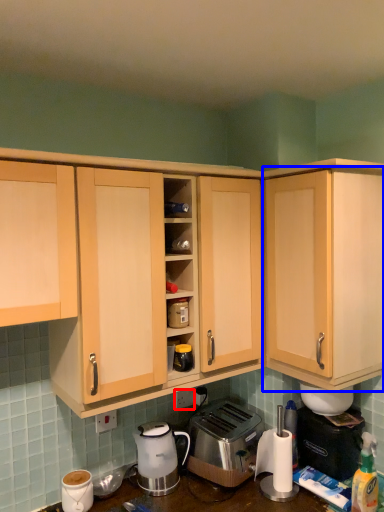
Question: Which of the following is the closest to the observer, electric outlet (highlighted by a red box) or cabinetry (highlighted by a blue box)?

Choices:
 (A) electric outlet
 (B) cabinetry

Answer: (B)